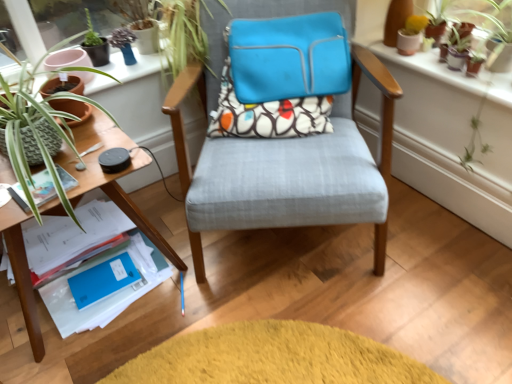
What are the coordinates of `empty space that is to the right of matte paper at left, arranged as the 1th paperback book when viewed from the top` in the screenshot? It's located at (86, 172).